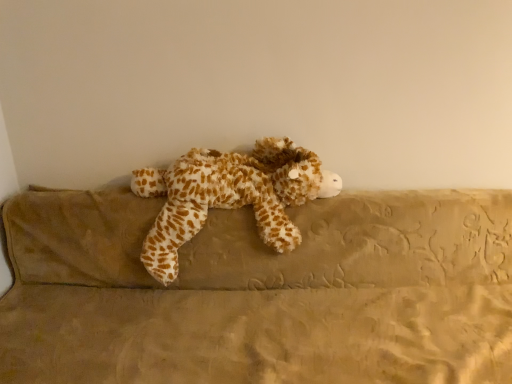
Question: From the image's perspective, relative to fuzzy brown and white stuffed animal at center, is brown plush couch at center above or below?

Choices:
 (A) above
 (B) below

Answer: (B)

Question: From a real-world perspective, is brown plush couch at center above or below fuzzy brown and white stuffed animal at center?

Choices:
 (A) below
 (B) above

Answer: (A)

Question: Is point (488, 349) closer or farther from the camera than point (271, 157)?

Choices:
 (A) closer
 (B) farther

Answer: (A)

Question: Considering their positions, is fuzzy brown and white stuffed animal at center located in front of or behind brown plush couch at center?

Choices:
 (A) front
 (B) behind

Answer: (B)

Question: Looking at their shapes, would you say fuzzy brown and white stuffed animal at center is wider or thinner than brown plush couch at center?

Choices:
 (A) wide
 (B) thin

Answer: (B)

Question: From the image's perspective, is fuzzy brown and white stuffed animal at center above or below brown plush couch at center?

Choices:
 (A) below
 (B) above

Answer: (B)

Question: Based on their sizes in the image, would you say fuzzy brown and white stuffed animal at center is bigger or smaller than brown plush couch at center?

Choices:
 (A) big
 (B) small

Answer: (B)